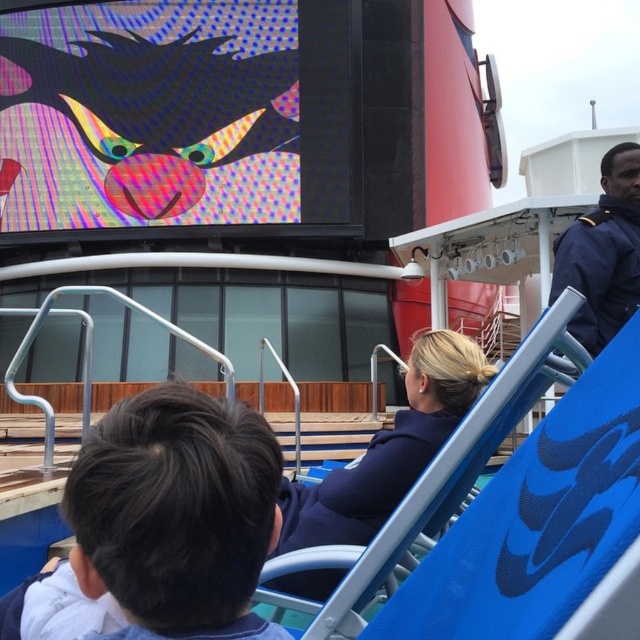
Question: Which object is closer to the camera taking this photo?

Choices:
 (A) blue uniform at upper right
 (B) navy blue coat at center
 (C) multicolored pixelated screen at upper left

Answer: (B)

Question: Is navy blue coat at center positioned behind blue uniform at upper right?

Choices:
 (A) no
 (B) yes

Answer: (A)

Question: Does multicolored pixelated screen at upper left come in front of blue uniform at upper right?

Choices:
 (A) no
 (B) yes

Answer: (A)

Question: Among these objects, which one is farthest from the camera?

Choices:
 (A) blue uniform at upper right
 (B) navy blue coat at center

Answer: (A)

Question: Which point appears farthest from the camera in this image?

Choices:
 (A) (412, 424)
 (B) (611, 282)
 (C) (250, 76)

Answer: (C)

Question: Can you confirm if multicolored pixelated screen at upper left is wider than navy blue coat at center?

Choices:
 (A) yes
 (B) no

Answer: (A)